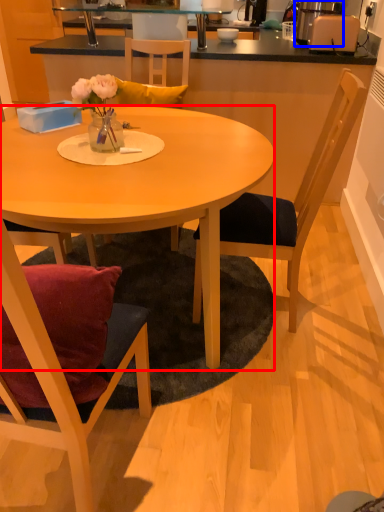
Question: Among these objects, which one is nearest to the camera, desk (highlighted by a red box) or appliance (highlighted by a blue box)?

Choices:
 (A) desk
 (B) appliance

Answer: (A)